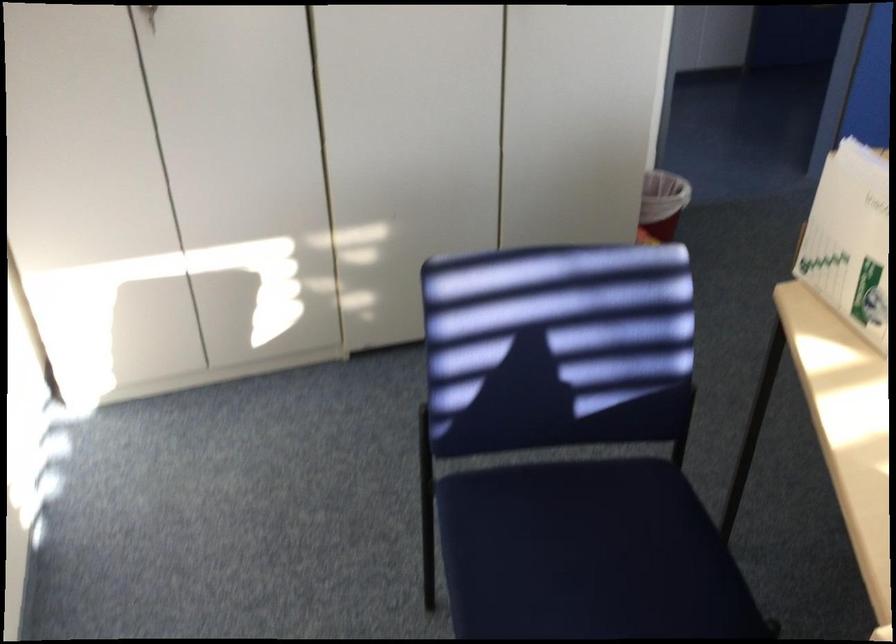
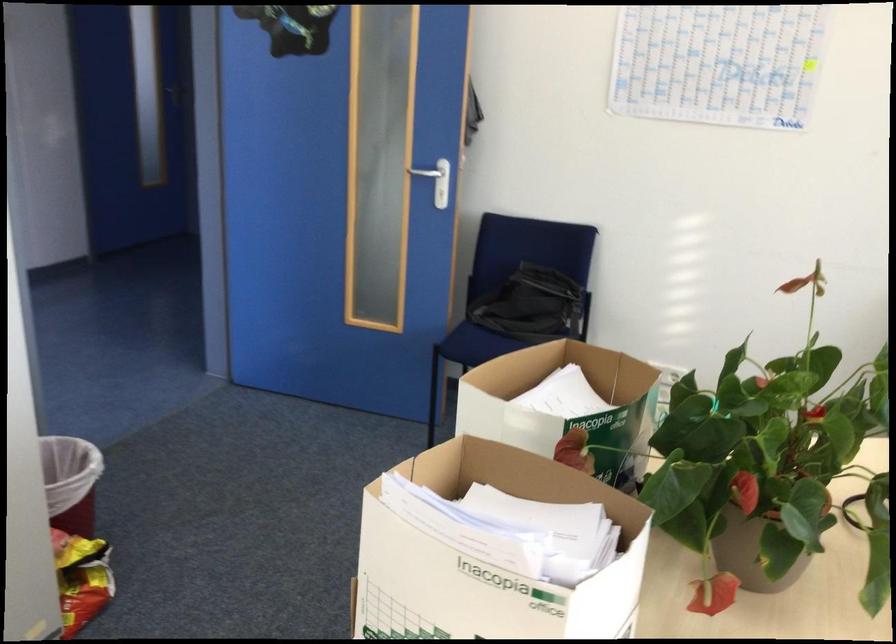
Question: The camera is either moving clockwise (left) or counter-clockwise (right) around the object. The first image is from the beginning of the video and the second image is from the end. Is the camera moving left or right when shooting the video?

Choices:
 (A) Left
 (B) Right

Answer: (A)